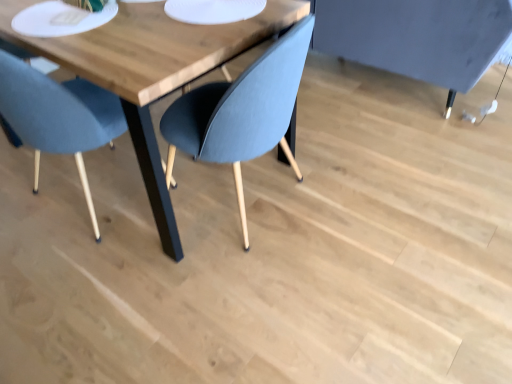
Where is `vacant space in between wooden table at center and matte blue chair at left`? The width and height of the screenshot is (512, 384). vacant space in between wooden table at center and matte blue chair at left is located at coordinates (61, 205).